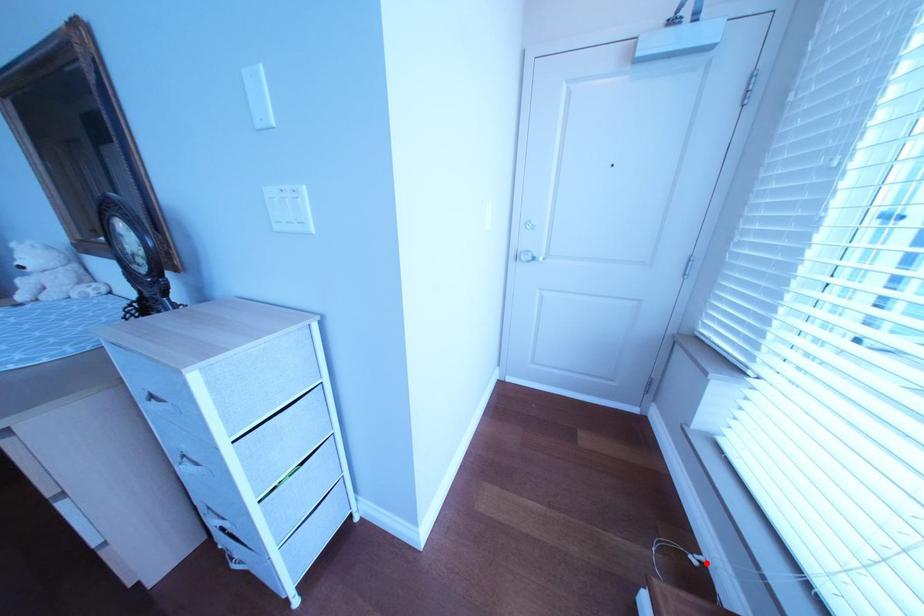
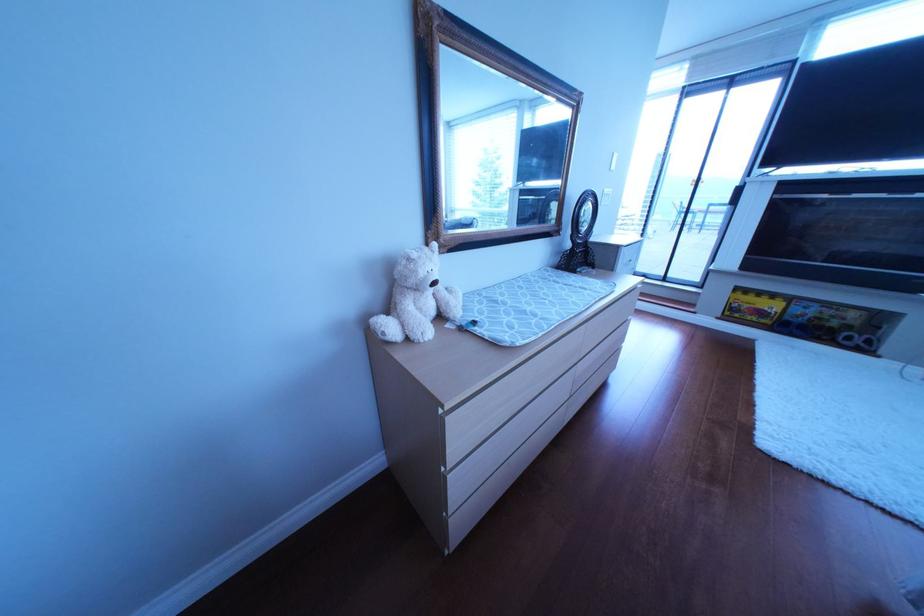
Question: I am providing you with two images of the same scene from different viewpoints. A red point is marked on the first image. At the location where the point appears in image 1, is it still visible in image 2?

Choices:
 (A) Yes
 (B) No

Answer: (B)